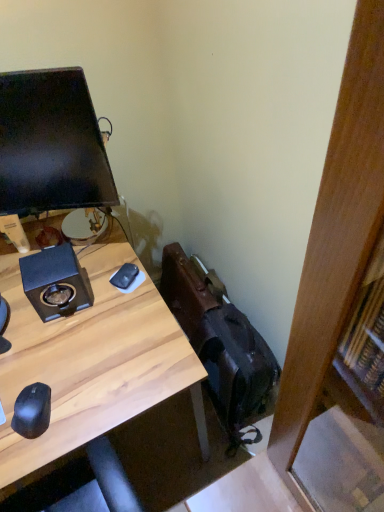
Where is `vacant space behind black matte mouse at center, the 1th mouse from the right`? The width and height of the screenshot is (384, 512). vacant space behind black matte mouse at center, the 1th mouse from the right is located at coordinates (110, 250).